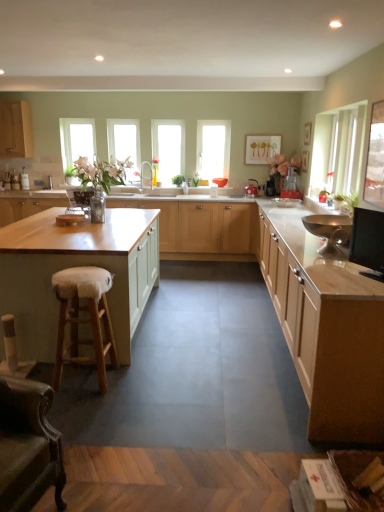
Question: Looking at their shapes, would you say matte wood cabinets at center, which is the third cabinetry in top-to-bottom order, is wider or thinner than metallic silver toaster at center, which is the 3th appliance from bottom to top?

Choices:
 (A) thin
 (B) wide

Answer: (B)

Question: From the image's perspective, is matte wood cabinets at center, the 3th cabinetry in the bottom-to-top sequence, located above or below metallic silver toaster at center, which is the 3th appliance from bottom to top?

Choices:
 (A) above
 (B) below

Answer: (B)

Question: Estimate the real-world distances between objects in this image. Which object is closer to the metallic red kettle at center, positioned as the 2th appliance in bottom-to-top order?

Choices:
 (A) clear glass window at center, marked as the third window in a left-to-right arrangement
 (B) clear glass window at left, placed as the 1th window when sorted from left to right
 (C) white furry stool at lower left
 (D) green leafy plant at center, which is the 1th plant from top to bottom
 (E) wooden island at center, acting as the 4th cabinetry starting from the bottom

Answer: (E)

Question: Which of these objects is positioned farthest from the clear glass window at center, the second window from the right?

Choices:
 (A) matte wood cabinet at upper left, positioned as the 1th cabinetry in top-to-bottom order
 (B) green leafy plant at center, arranged as the 2th plant when ordered from the bottom
 (C) light wood cabinet at right, the 5th cabinetry viewed from the top
 (D) clear glass window at center, which is counted as the 1th window, starting from the right
 (E) wooden island at center, the second cabinetry viewed from the top

Answer: (C)